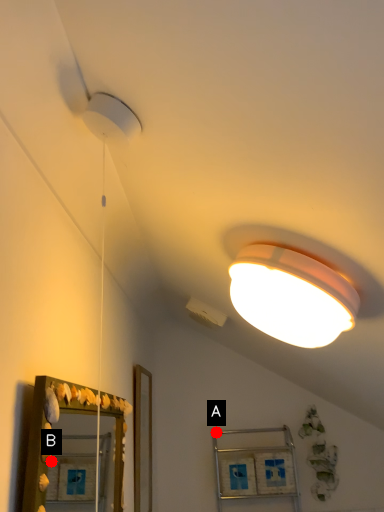
Question: Two points are circled on the image, labeled by A and B beside each circle. Which point is closer to the camera taking this photo?

Choices:
 (A) A is closer
 (B) B is closer

Answer: (B)